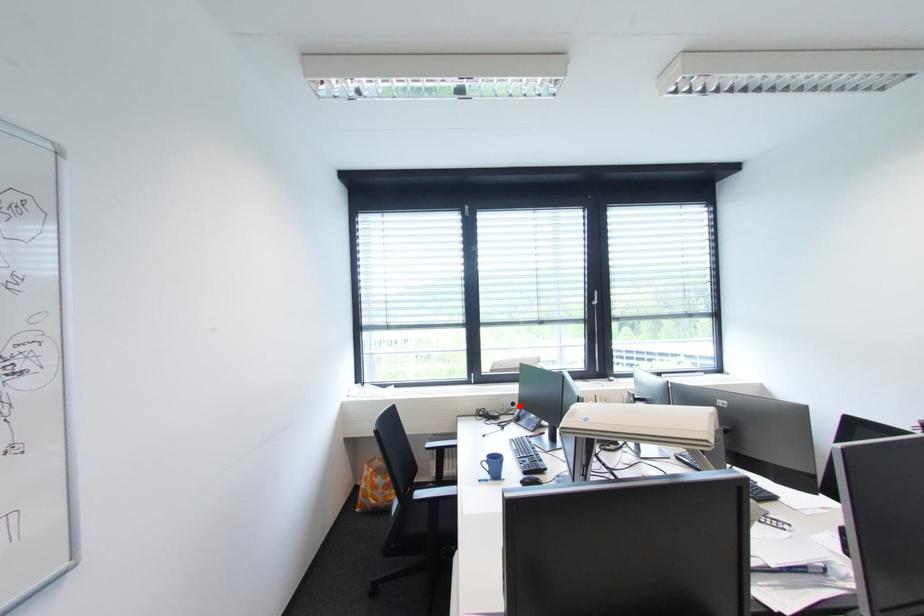
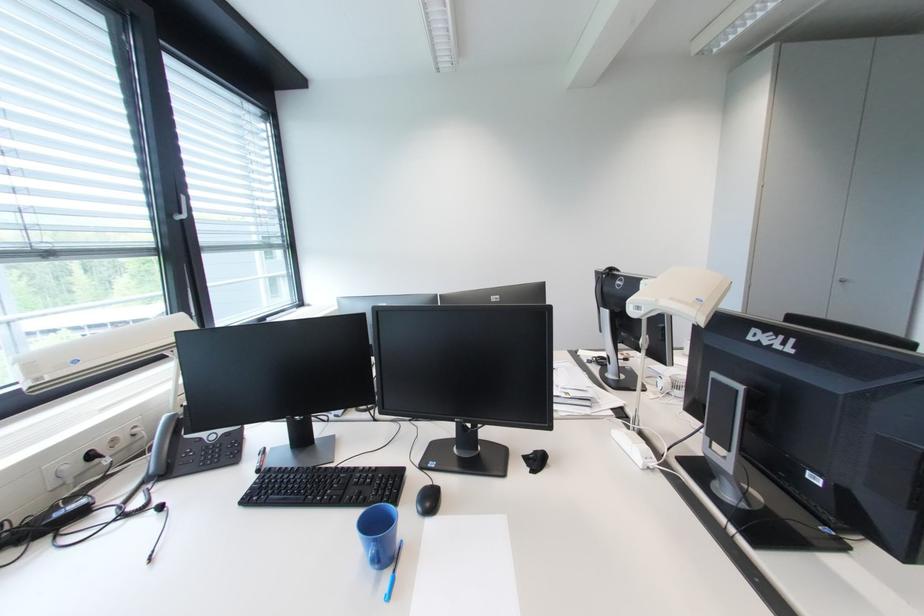
The point at the highlighted location is marked in the first image. Where is the corresponding point in the second image?

(98, 458)